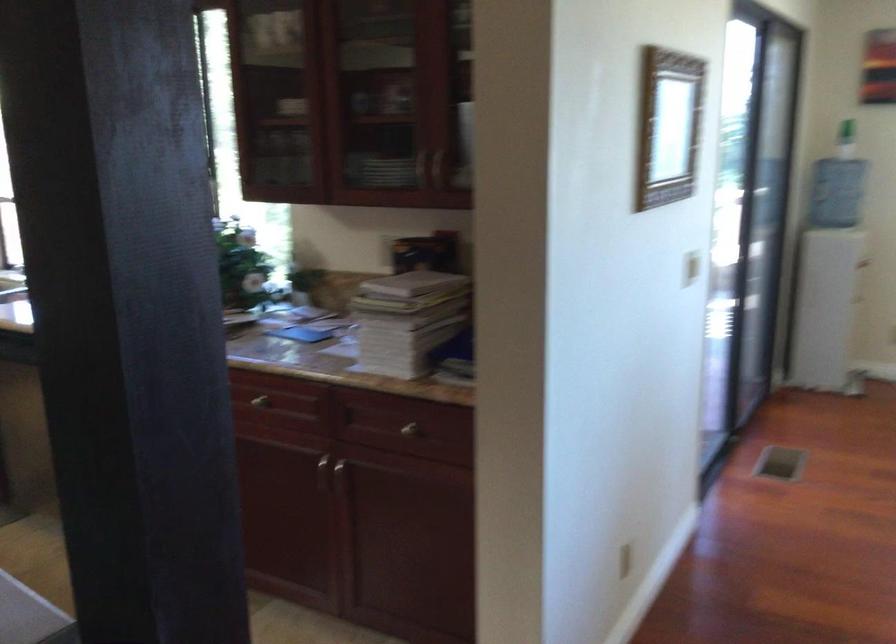
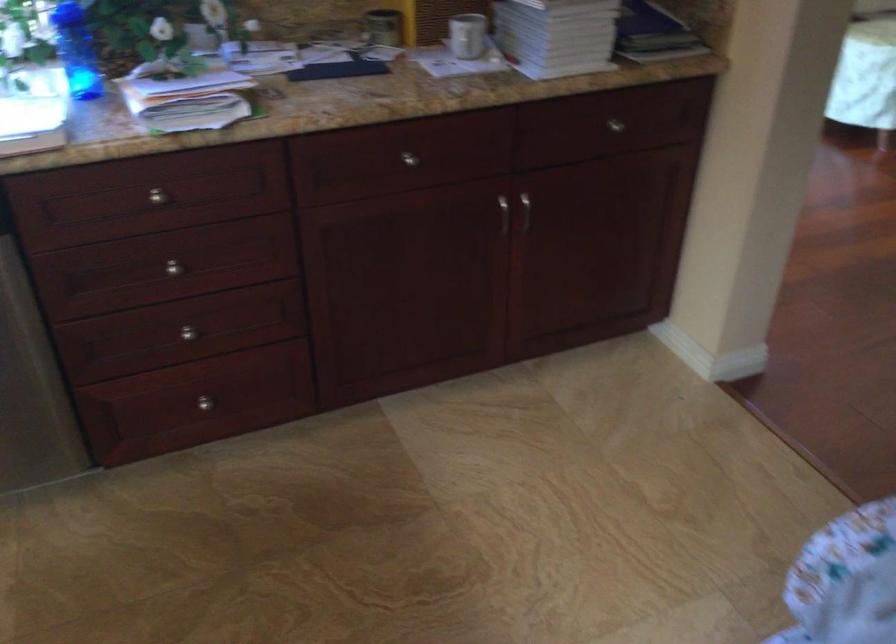
Locate, in the second image, the point that corresponds to (x=338, y=478) in the first image.

(515, 213)